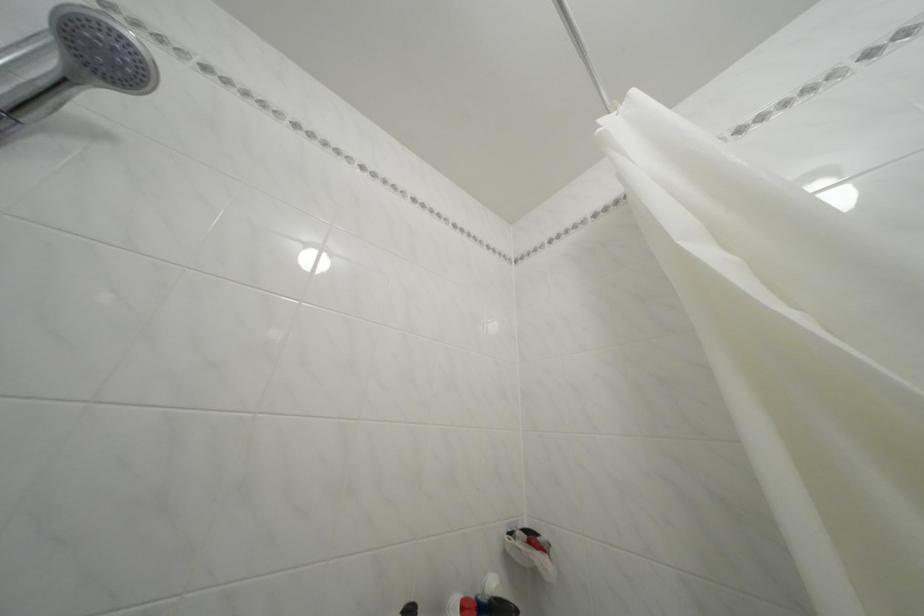
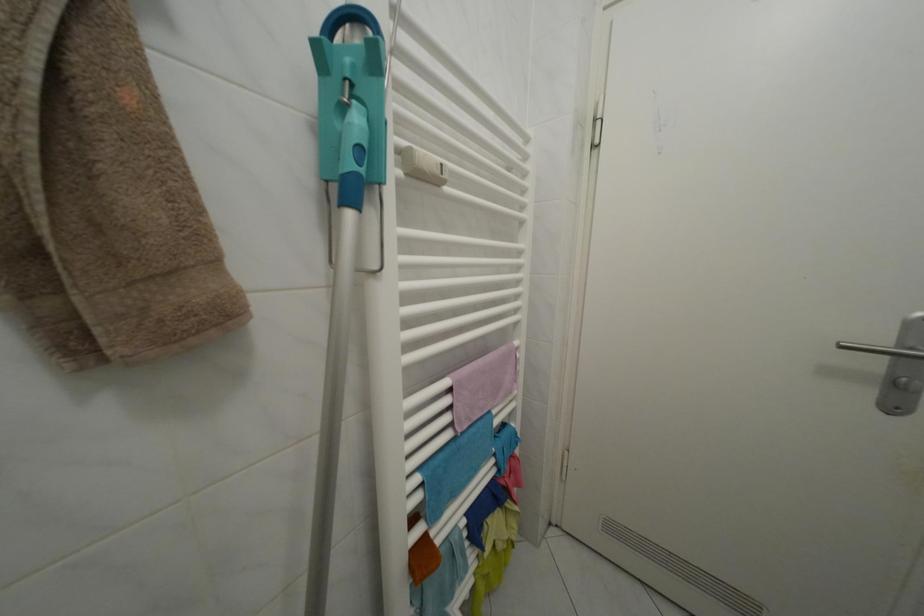
Question: The camera is either moving clockwise (left) or counter-clockwise (right) around the object. The first image is from the beginning of the video and the second image is from the end. Is the camera moving left or right when shooting the video?

Choices:
 (A) Left
 (B) Right

Answer: (A)